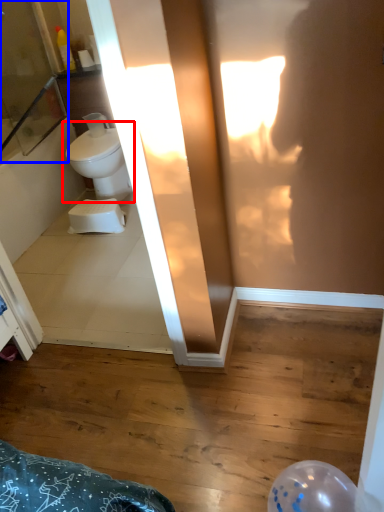
Question: Which of the following is the closest to the observer, toilet (highlighted by a red box) or screen door (highlighted by a blue box)?

Choices:
 (A) toilet
 (B) screen door

Answer: (B)